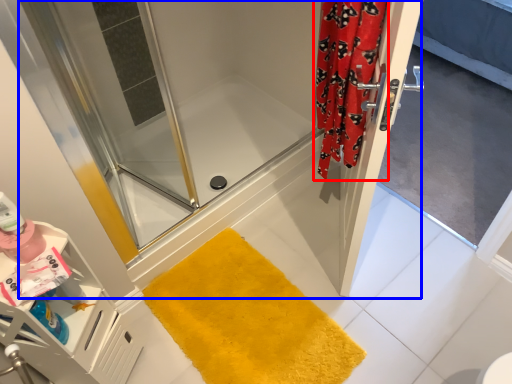
Question: Among these objects, which one is nearest to the camera, shower curtain (highlighted by a red box) or shower door (highlighted by a blue box)?

Choices:
 (A) shower curtain
 (B) shower door

Answer: (A)